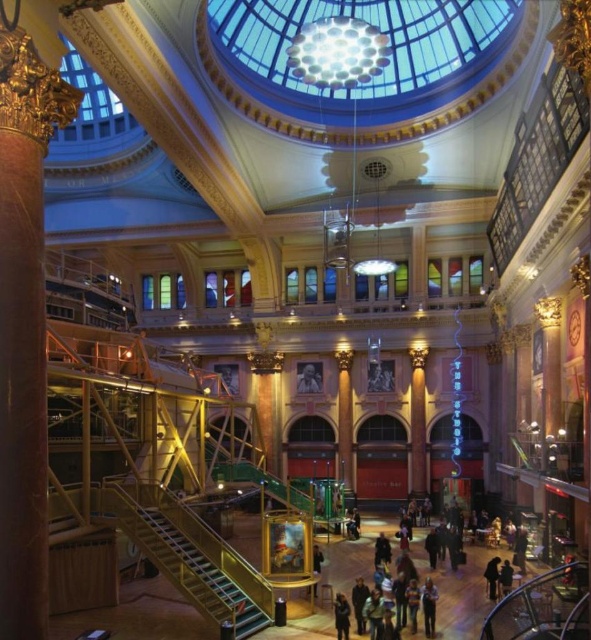
Is point (9, 330) positioned in front of point (167, 518)?

Yes, it is in front of point (167, 518).

Which is in front, point (27, 205) or point (258, 595)?

Point (27, 205)

What do you see at coordinates (24, 326) in the screenshot? I see `gold ornate column at left` at bounding box center [24, 326].

You are a GUI agent. You are given a task and a screenshot of the screen. Output one action in this format:
    pyautogui.click(x=<x>, y=<y>)
    Task: Click on the gold ornate column at left
    
    Given the screenshot: What is the action you would take?
    pyautogui.click(x=24, y=326)

Is metallic staircase at lower center below blue denim jeans at lower center?

Incorrect, metallic staircase at lower center is not positioned below blue denim jeans at lower center.

The height and width of the screenshot is (640, 591). What do you see at coordinates (189, 556) in the screenshot?
I see `metallic staircase at lower center` at bounding box center [189, 556].

You are a GUI agent. You are given a task and a screenshot of the screen. Output one action in this format:
    pyautogui.click(x=<x>, y=<y>)
    Task: Click on the metallic staircase at lower center
    
    Given the screenshot: What is the action you would take?
    189,556

Based on the photo, is smooth skin face at center to the left of dark clothing at lower right from the viewer's perspective?

Yes, smooth skin face at center is to the left of dark clothing at lower right.

Does point (306, 392) come in front of point (493, 561)?

No, (306, 392) is further to viewer.

Locate an element on the screen. This screenshot has width=591, height=640. smooth skin face at center is located at coordinates (310, 378).